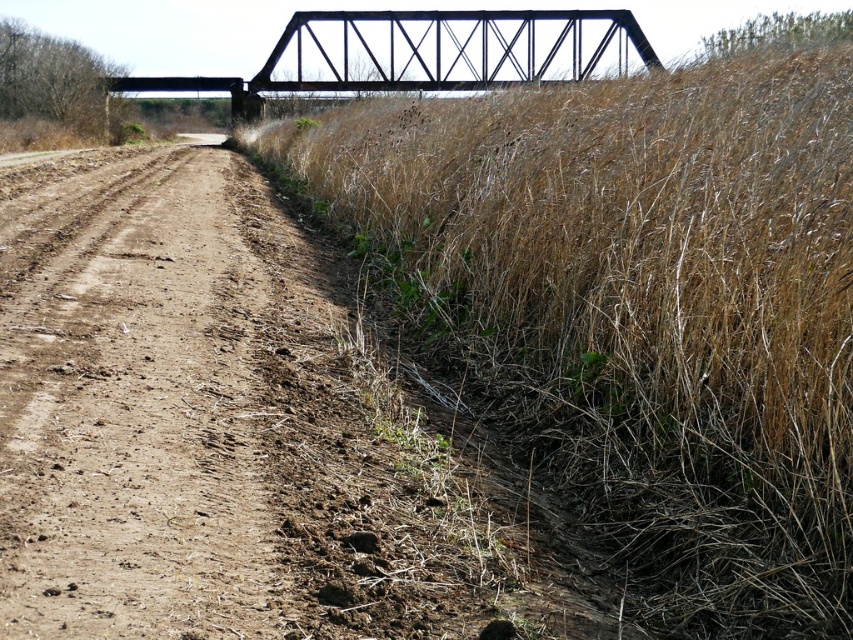
Who is lower down, dry grass at upper right or black metal bridge at upper center?

Positioned lower is dry grass at upper right.

Is dry grass at upper right wider than black metal bridge at upper center?

No, dry grass at upper right is not wider than black metal bridge at upper center.

What are the coordinates of `dry grass at upper right` in the screenshot? It's located at (639, 305).

Who is more forward, (242, 602) or (322, 17)?

Point (242, 602) is more forward.

Is point (171, 314) positioned behind point (260, 86)?

No, (171, 314) is closer to viewer.

Which is in front, point (1, 468) or point (613, 19)?

Positioned in front is point (1, 468).

Locate an element on the screen. This screenshot has height=640, width=853. brown dirt track at left is located at coordinates (138, 433).

Does dry grass at upper right appear on the left side of brown dirt track at left?

No, dry grass at upper right is not to the left of brown dirt track at left.

What do you see at coordinates (639, 305) in the screenshot? I see `dry grass at upper right` at bounding box center [639, 305].

Identify the location of dry grass at upper right. This screenshot has height=640, width=853. (639, 305).